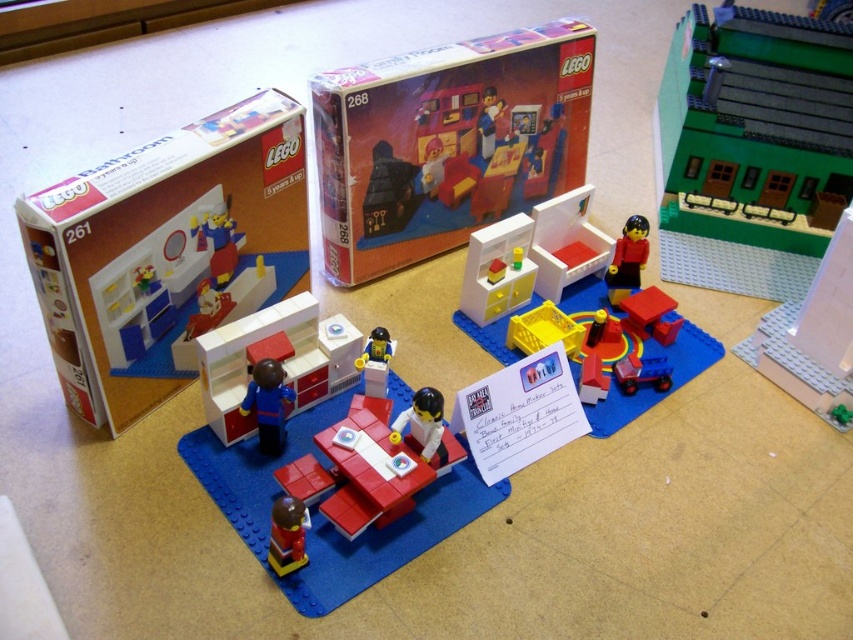
Question: Based on their relative distances, which object is nearer to the smooth plastic minifigure at center?

Choices:
 (A) matte red lego box at center
 (B) smooth black figure at upper right
 (C) matte red chair at upper left
 (D) smooth red toy at center

Answer: (D)

Question: Is smooth red truck at center further to the viewer compared to matte blue truck at center?

Choices:
 (A) no
 (B) yes

Answer: (B)

Question: Which object appears farthest from the camera in this image?

Choices:
 (A) matte white cabinet at center
 (B) smooth white cabinet at center

Answer: (B)

Question: Does matte red lego box at center appear on the left side of matte red chair at upper left?

Choices:
 (A) no
 (B) yes

Answer: (A)

Question: Is matte red lego box at center behind green plastic train at upper right?

Choices:
 (A) no
 (B) yes

Answer: (A)

Question: Which point appears closest to the camera in this image?

Choices:
 (A) click(630, 369)
 (B) click(598, 241)
 (C) click(358, 362)

Answer: (C)